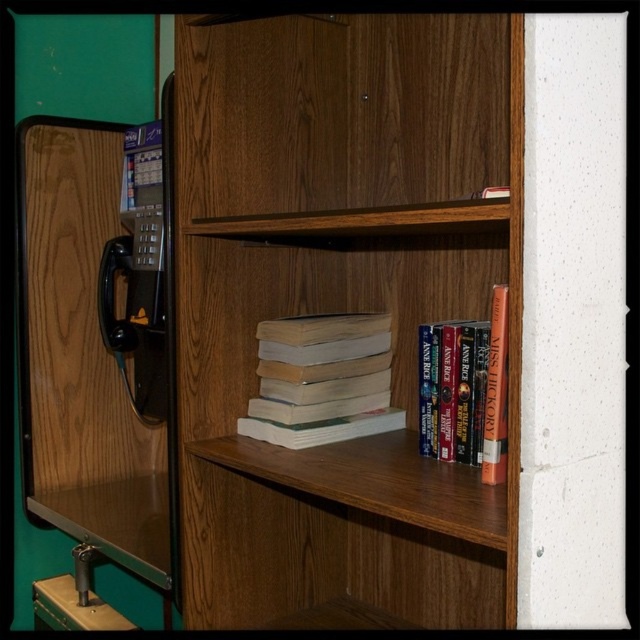
You are a delivery person trying to place a large package between the wooden bookcase at center and the black plastic payphone at left. The package is 16 inches wide. Can it fit in the space between them?

The wooden bookcase at center and black plastic payphone at left are 15.57 inches apart from each other. Since the package is 16 inches wide, which is slightly wider than the available space, it cannot fit between them.

You are trying to place a 9 inch wide decorative object on the middle shelf of the bookshelf. The white matte book at center and the hardcover book at center are the only two books on the middle shelf. Can you fit the object between them?

The white matte book at center and hardcover book at center are 8.63 inches apart from each other. Since the decorative object is 9 inches wide, it cannot fit between them because the space is slightly narrower than the object.